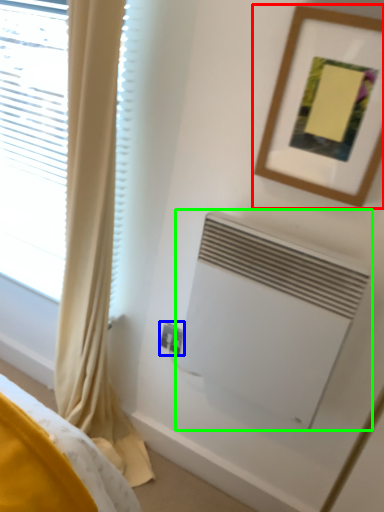
Question: Which object is positioned closest to picture frame (highlighted by a red box)? Select from electric outlet (highlighted by a blue box) and air conditioning (highlighted by a green box).

Choices:
 (A) electric outlet
 (B) air conditioning

Answer: (B)